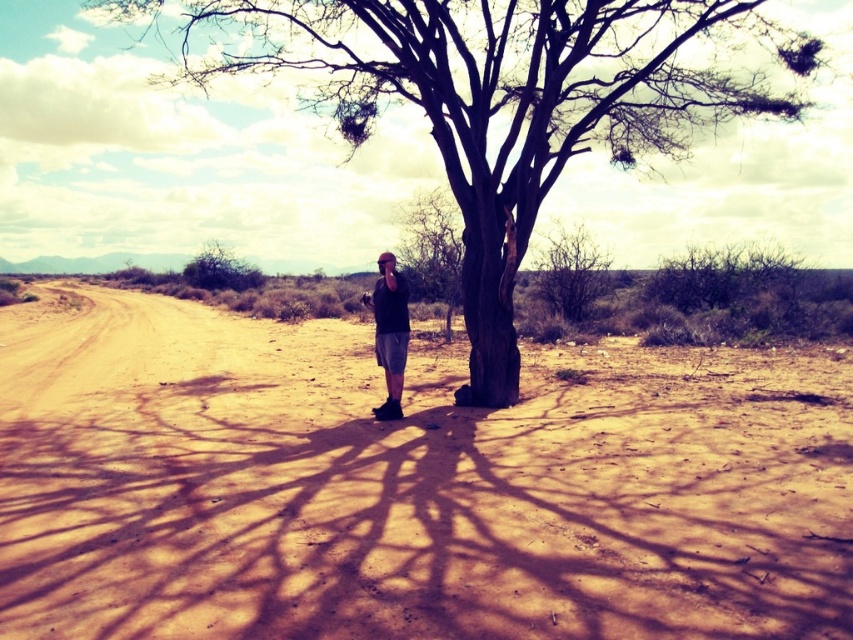
You are an explorer in the desert and see a matte black shirt at center and a green leafy bush at upper left. Which object is positioned more to the east in the image?

The matte black shirt at center is positioned to the right of the green leafy bush at upper left. Since the image shows the desert landscape with the mountains in the background, the right side of the image corresponds to the east direction. Therefore, the matte black shirt at center is more to the east.

You are a hiker who wants to take a photo of the matte black shirt at center and the green leafy bush at upper left. Which object should you focus on first if you want to capture both in a single frame without moving the camera?

You should focus on the matte black shirt at center first because it occupies less space than the green leafy bush at upper left, allowing more room to include both in the frame.

You are a photographer planning to capture a wide landscape shot of the desert scene. You need to ensure that both the matte black shirt at center and the green leafy bush at upper left are visible in your frame. Given their sizes, which object might require you to adjust your camera angle to include it fully?

The green leafy bush at upper left might require adjusting the camera angle because its width is larger than the matte black shirt at center, so it may not fit within the current frame without adjustment.